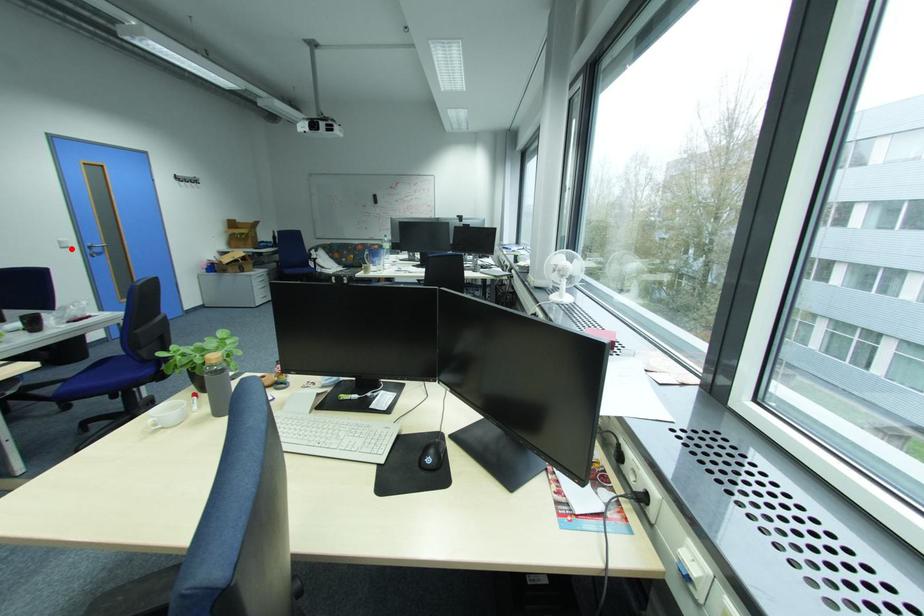
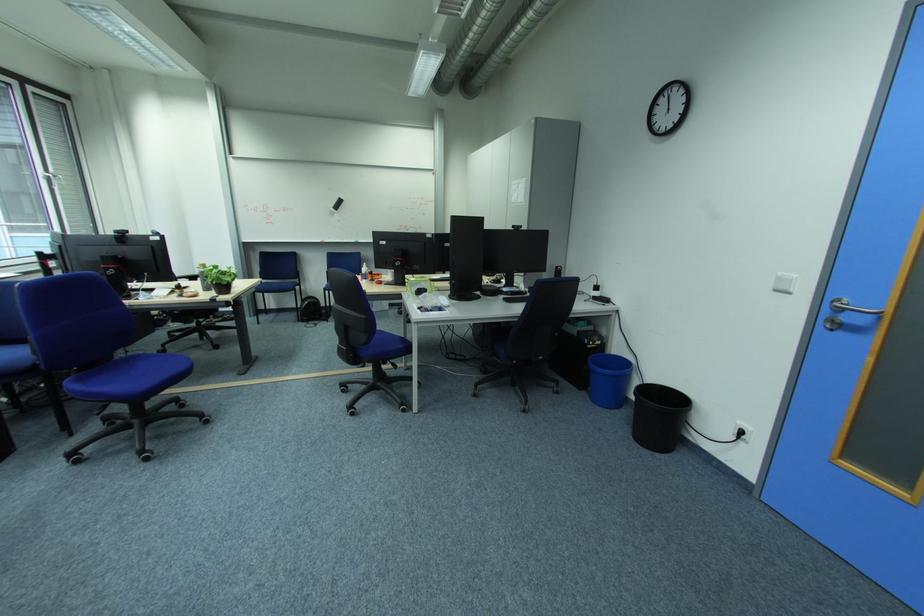
Locate, in the second image, the point that corresponds to the highlighted location in the first image.

(785, 292)